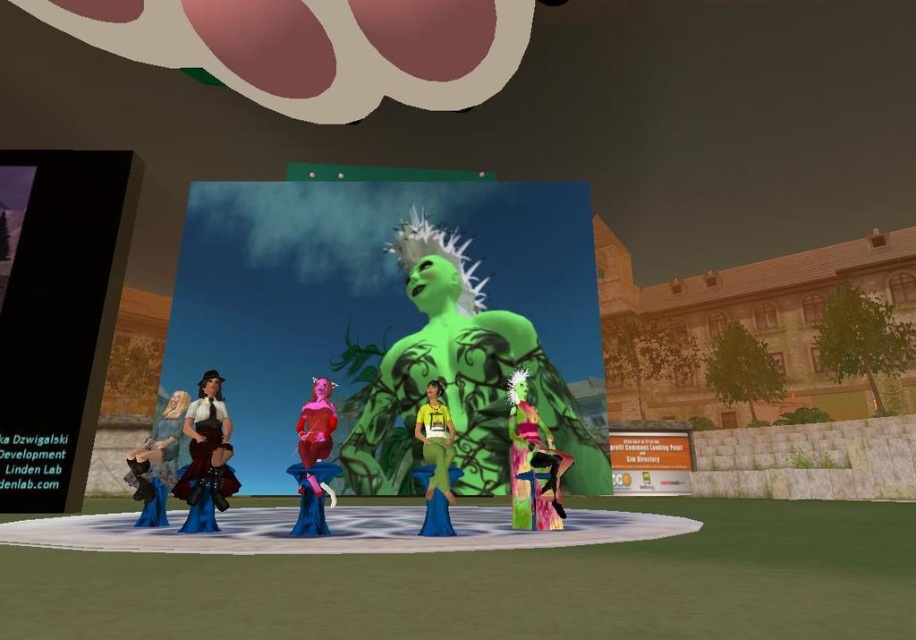
Is green matte statue at center smaller than matte brown leather vest at left?

Yes, green matte statue at center is smaller than matte brown leather vest at left.

Does green matte statue at center have a lesser width compared to matte brown leather vest at left?

No.

Describe the element at coordinates (391, 320) in the screenshot. I see `green matte statue at center` at that location.

This screenshot has width=916, height=640. I want to click on green matte statue at center, so click(391, 320).

Is green matte statue at center behind yellow matte dress at center?

Yes, it is.

Is point (463, 184) farther from camera compared to point (431, 458)?

That is True.

Where is `green matte statue at center`? The height and width of the screenshot is (640, 916). green matte statue at center is located at coordinates (391, 320).

Which of these two, matte blue dress at lower left or matte red devil at center, stands taller?

matte red devil at center

Consider the image. Can you confirm if matte blue dress at lower left is thinner than matte red devil at center?

In fact, matte blue dress at lower left might be wider than matte red devil at center.

From the picture: Measure the distance between matte blue dress at lower left and camera.

4.65 meters

Where is `matte blue dress at lower left`? The image size is (916, 640). matte blue dress at lower left is located at coordinates pos(158,451).